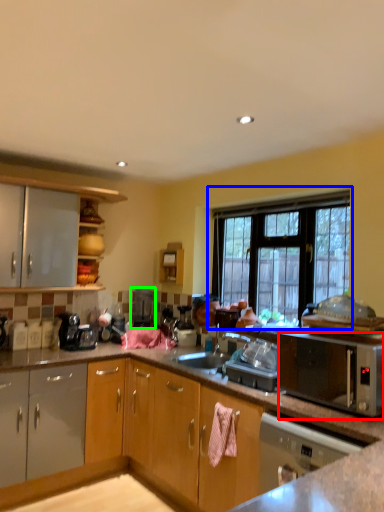
Question: Which object is the closest to the microwave oven (highlighted by a red box)? Choose among these: window (highlighted by a blue box) or appliance (highlighted by a green box).

Choices:
 (A) window
 (B) appliance

Answer: (A)